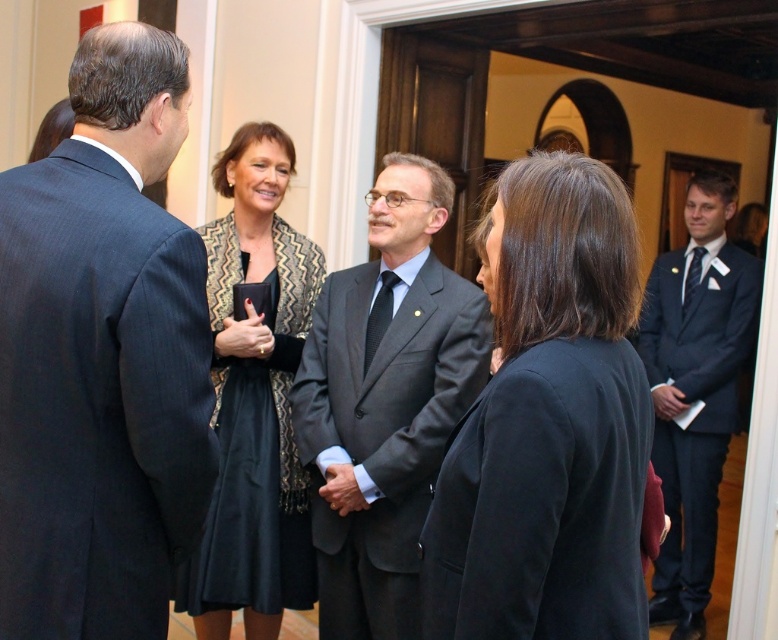
Can you confirm if dark blue suit at left is bigger than black matte blazer at center?

Yes, dark blue suit at left is bigger than black matte blazer at center.

Does dark blue suit at left lie in front of black matte blazer at center?

That is False.

Where is `dark blue suit at left`? The height and width of the screenshot is (640, 778). dark blue suit at left is located at coordinates (102, 356).

What are the coordinates of `dark blue suit at left` in the screenshot? It's located at (102, 356).

Who is positioned more to the left, dark blue suit at left or dark blue suit at right?

Positioned to the left is dark blue suit at left.

Between point (0, 580) and point (706, 381), which one is positioned behind?

Point (706, 381)

Locate an element on the screen. This screenshot has width=778, height=640. dark blue suit at left is located at coordinates (102, 356).

Image resolution: width=778 pixels, height=640 pixels. What do you see at coordinates (102, 356) in the screenshot?
I see `dark blue suit at left` at bounding box center [102, 356].

From the picture: Who is more distant from viewer, (202, 426) or (263, 154)?

The point (263, 154) is behind.

Is point (53, 340) positioned behind point (237, 161)?

No, it is in front of (237, 161).

You are a GUI agent. You are given a task and a screenshot of the screen. Output one action in this format:
    pyautogui.click(x=<x>, y=<y>)
    Task: Click on the dark blue suit at left
    This screenshot has width=778, height=640.
    Given the screenshot: What is the action you would take?
    pyautogui.click(x=102, y=356)